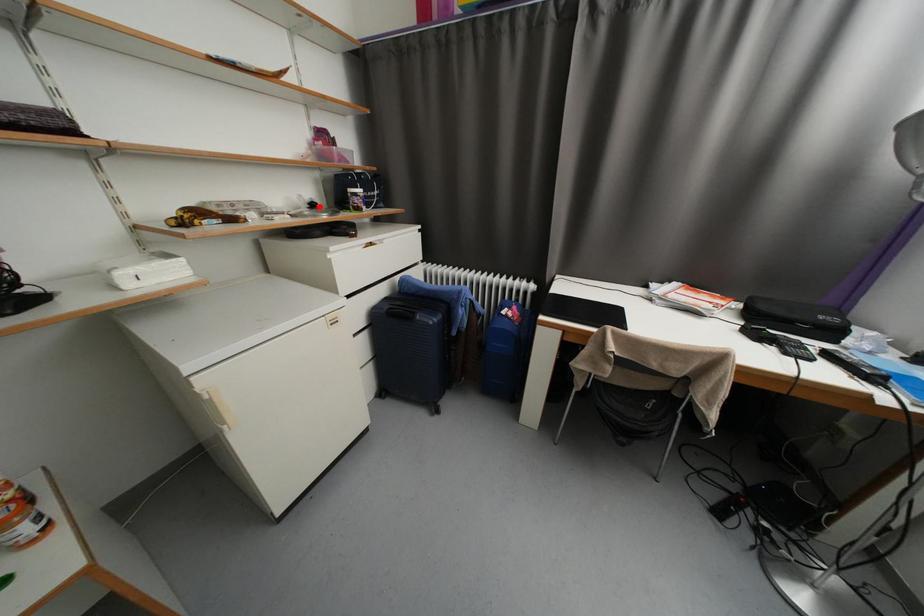
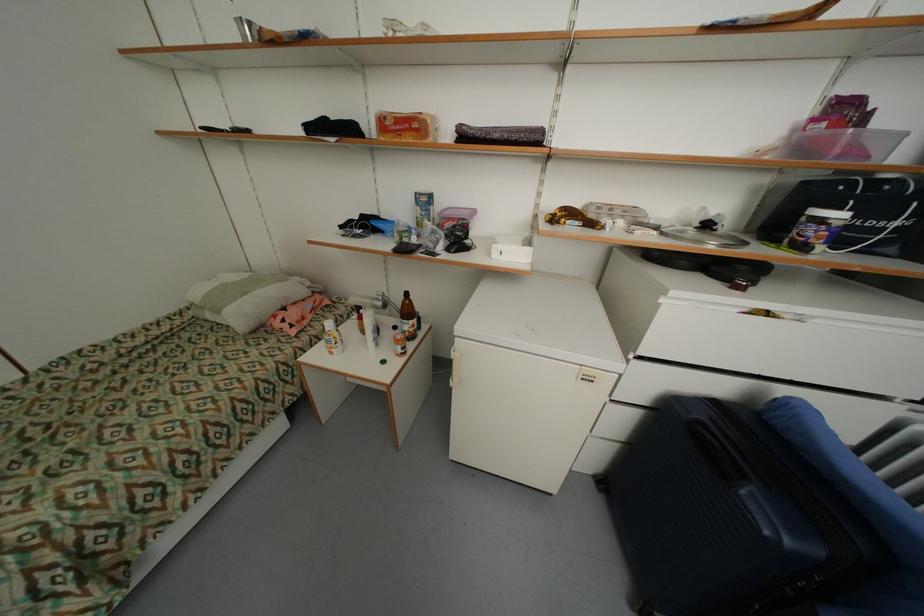
Where in the second image is the point corresponding to the highlighted location from the first image?

(713, 227)